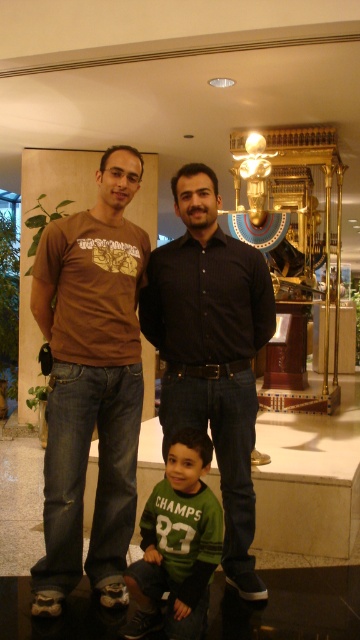
Question: Does black matte shirt at center appear under green jersey at center?

Choices:
 (A) no
 (B) yes

Answer: (A)

Question: Does brown cotton t-shirt at center appear on the left side of black matte shirt at center?

Choices:
 (A) no
 (B) yes

Answer: (B)

Question: Which point is closer to the camera?

Choices:
 (A) (174, 524)
 (B) (110, 253)
 (C) (150, 312)

Answer: (A)

Question: Considering the real-world distances, which object is closest to the brown cotton t-shirt at center?

Choices:
 (A) green jersey at center
 (B) black matte shirt at center

Answer: (B)

Question: Does black matte shirt at center have a larger size compared to green jersey at center?

Choices:
 (A) yes
 (B) no

Answer: (A)

Question: Which of these objects is positioned closest to the black matte shirt at center?

Choices:
 (A) green jersey at center
 (B) brown cotton t-shirt at center

Answer: (B)